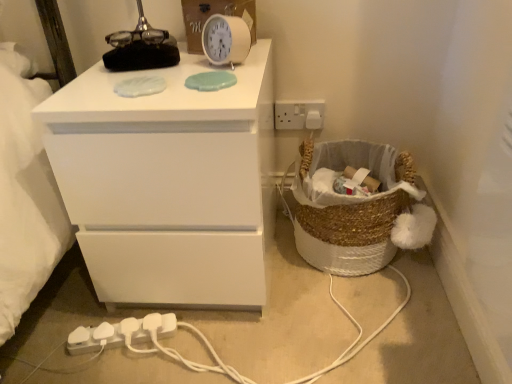
Find the location of a particular element. This screenshot has width=512, height=384. vacant space in front of braided wicker basket at lower right is located at coordinates (359, 327).